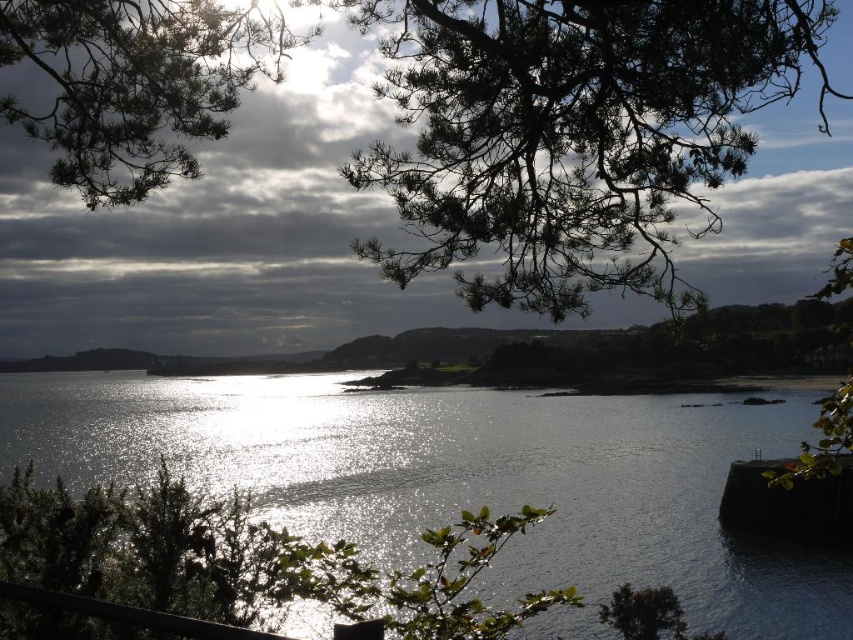
Question: Which object is closer to the camera taking this photo?

Choices:
 (A) green needle-like branches at upper left
 (B) shiny reflective water at center
 (C) dark green pine branches at upper center

Answer: (A)

Question: Estimate the real-world distances between objects in this image. Which object is farther from the green needle-like branches at upper left?

Choices:
 (A) shiny reflective water at center
 (B) dark green pine branches at upper center

Answer: (A)

Question: Is dark green pine branches at upper center smaller than green needle-like branches at upper left?

Choices:
 (A) yes
 (B) no

Answer: (B)

Question: Which object is positioned farthest from the shiny reflective water at center?

Choices:
 (A) dark green pine branches at upper center
 (B) green needle-like branches at upper left

Answer: (B)

Question: Is shiny reflective water at center wider than green needle-like branches at upper left?

Choices:
 (A) yes
 (B) no

Answer: (B)

Question: Can you confirm if shiny reflective water at center is positioned above green needle-like branches at upper left?

Choices:
 (A) no
 (B) yes

Answer: (A)